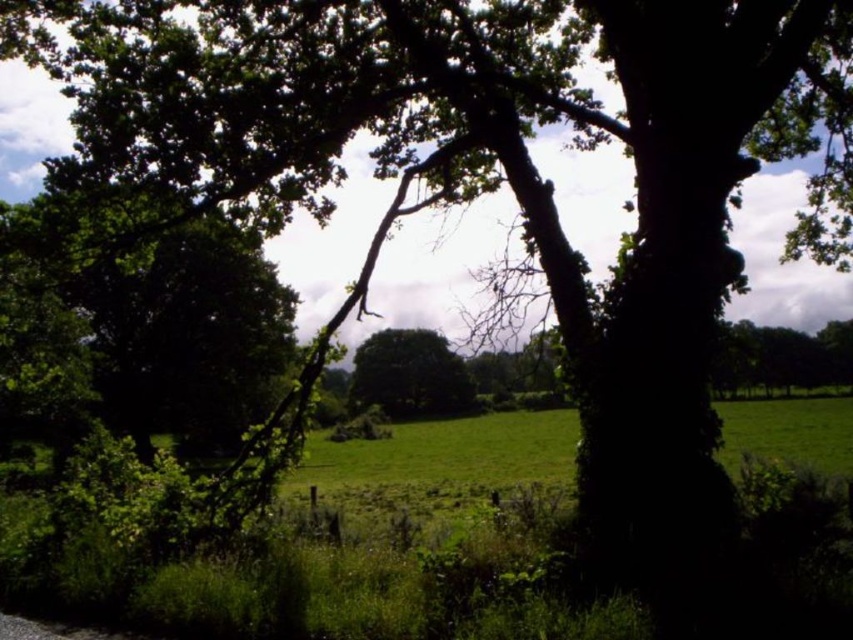
Question: Which point appears farthest from the camera in this image?

Choices:
 (A) (231, 243)
 (B) (393, 349)

Answer: (B)

Question: Is green leafy tree at left to the right of green leafy tree at center from the viewer's perspective?

Choices:
 (A) yes
 (B) no

Answer: (B)

Question: Does green leafy tree at left appear under green leafy tree at center?

Choices:
 (A) yes
 (B) no

Answer: (B)

Question: Which object appears farthest from the camera in this image?

Choices:
 (A) green leafy tree at left
 (B) green leafy tree at center

Answer: (B)

Question: Among these objects, which one is farthest from the camera?

Choices:
 (A) green leafy tree at center
 (B) green leafy tree at left

Answer: (A)

Question: Does green leafy tree at left lie behind green leafy tree at center?

Choices:
 (A) no
 (B) yes

Answer: (A)